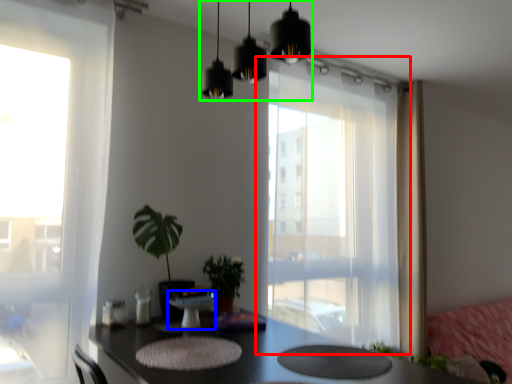
Question: Based on their relative distances, which object is farther from window (highlighted by a red box)? Choose from round table (highlighted by a blue box) and lighting (highlighted by a green box).

Choices:
 (A) round table
 (B) lighting

Answer: (B)